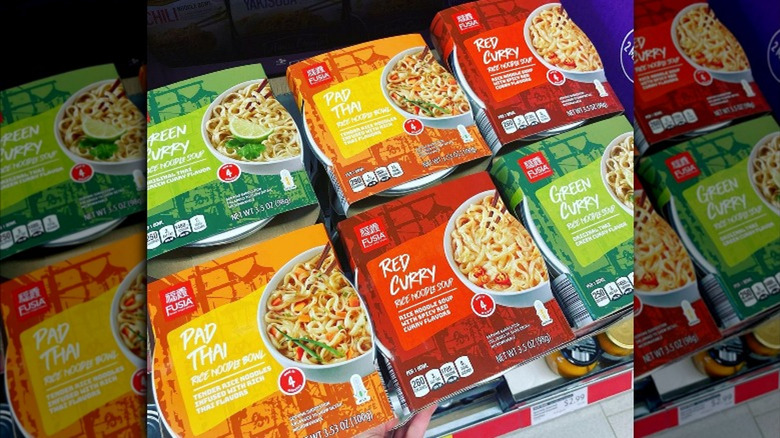
You are a GUI agent. You are given a task and a screenshot of the screen. Output one action in this format:
    pyautogui.click(x=<x>, y=<y>)
    Task: Click on the shaded panel
    
    Given the screenshot: What is the action you would take?
    pyautogui.click(x=80, y=193), pyautogui.click(x=679, y=183)